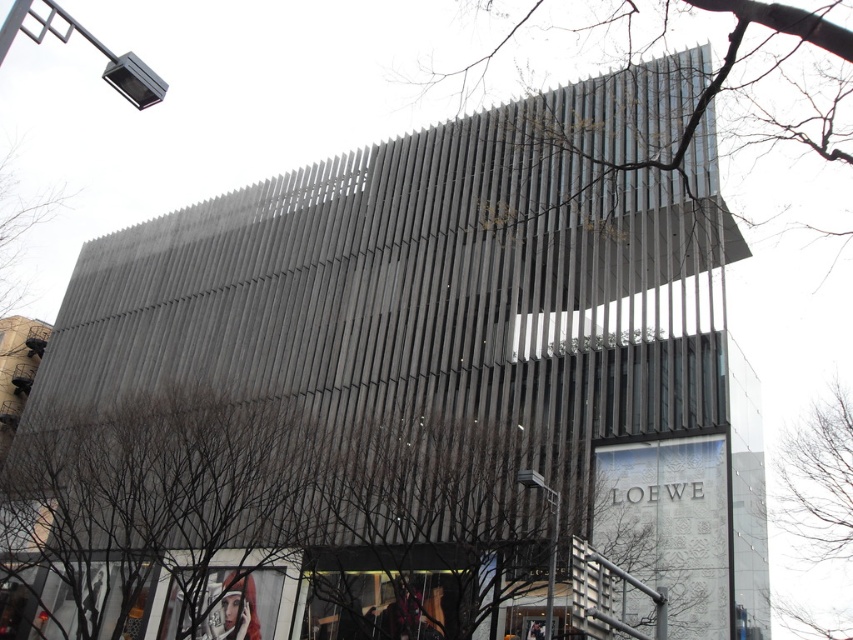
Question: Does bare branches at upper center appear under bare branches at right?

Choices:
 (A) yes
 (B) no

Answer: (B)

Question: From the image, what is the correct spatial relationship of bare branches at upper center in relation to bare branches at right?

Choices:
 (A) right
 (B) left

Answer: (B)

Question: In this image, where is bare branches at upper center located relative to bare branches at right?

Choices:
 (A) left
 (B) right

Answer: (A)

Question: Which point is closer to the camera?

Choices:
 (A) bare branches at right
 (B) bare branches at upper center

Answer: (B)

Question: Which point appears closest to the camera in this image?

Choices:
 (A) (810, 552)
 (B) (750, 90)

Answer: (B)